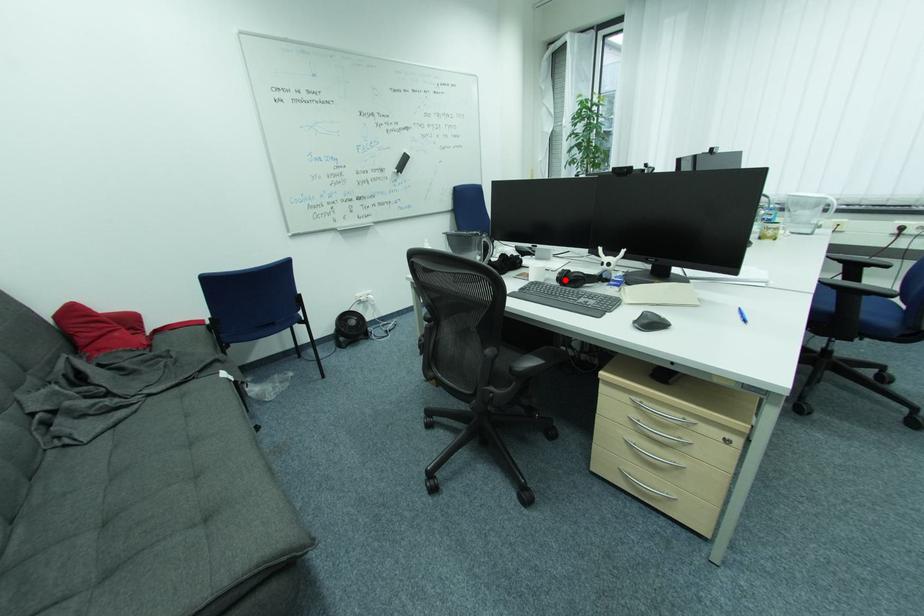
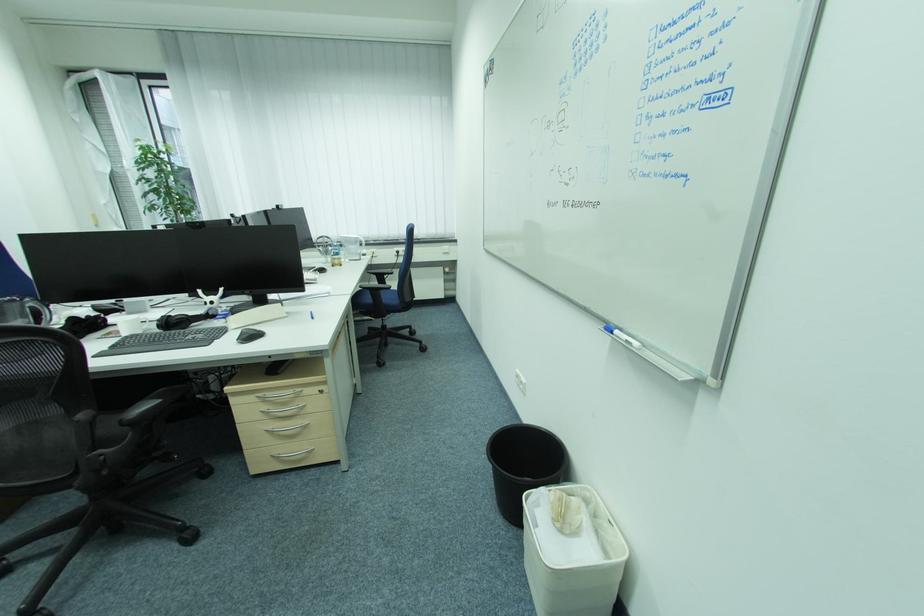
In the second image, find the point that corresponds to the highlighted location in the first image.

(166, 328)